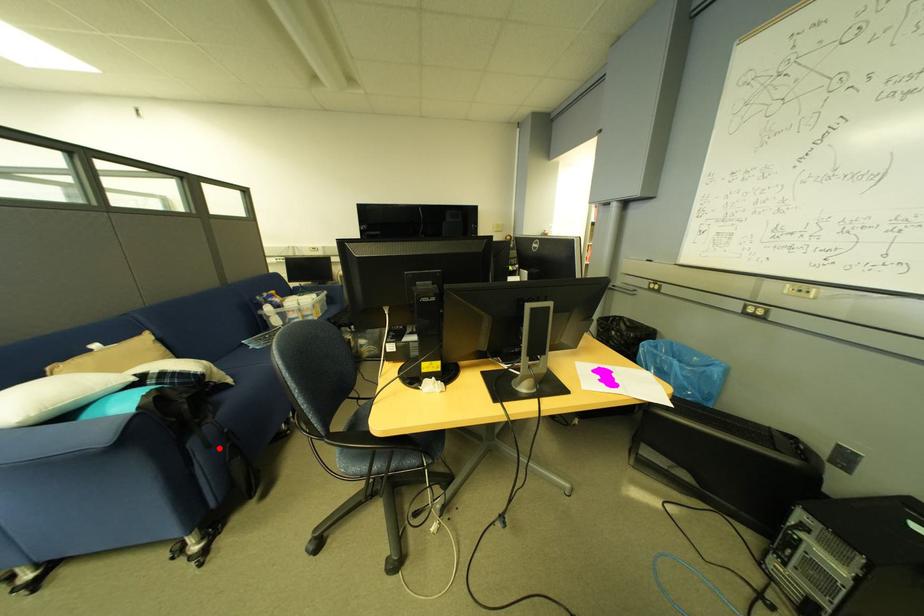
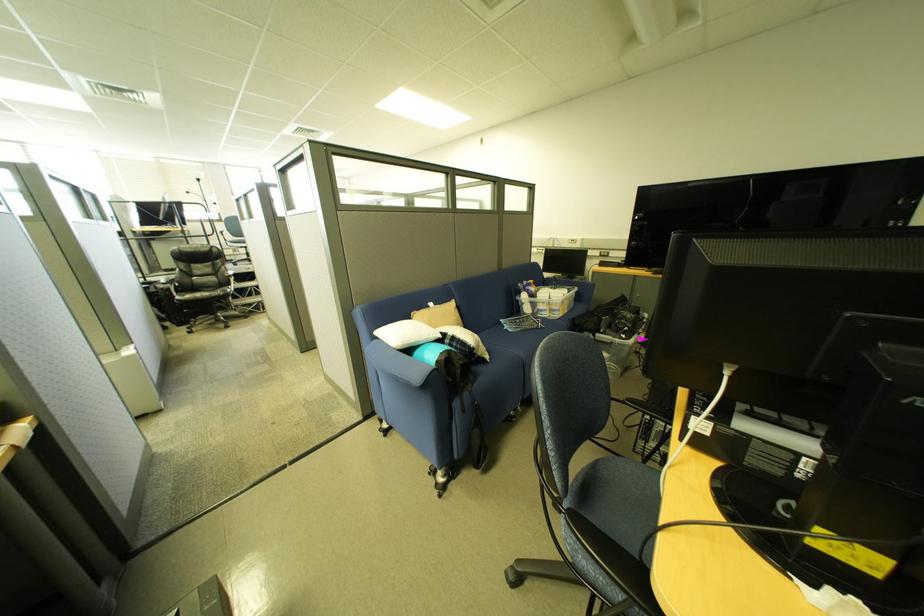
Question: I am providing you with two images of the same scene from different viewpoints. Given a red point in image1, look at the same physical point in image2. Is it:

Choices:
 (A) Closer to the viewpoint
 (B) Farther from the viewpoint

Answer: (B)